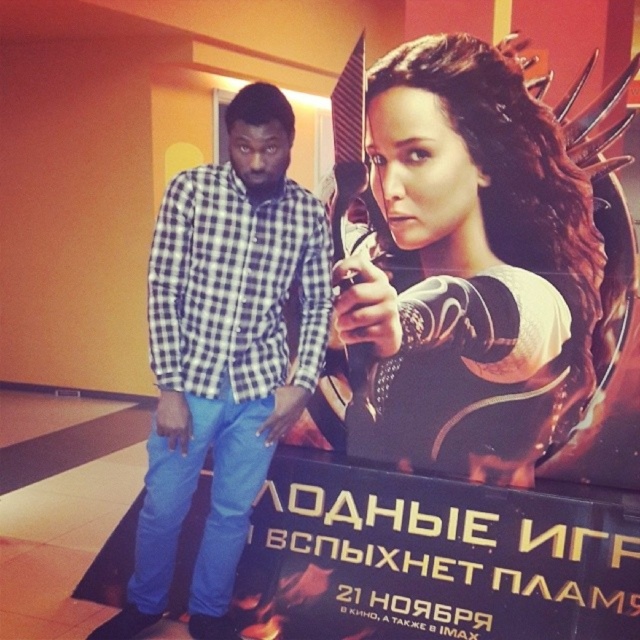
Which is more to the left, shiny black armor at center or checkered fabric shirt at center?

checkered fabric shirt at center

At what (x,y) coordinates should I click in order to perform the action: click on shiny black armor at center. Please return your answer as a coordinate pair (x, y). Looking at the image, I should click on (468, 268).

The width and height of the screenshot is (640, 640). Describe the element at coordinates (468, 268) in the screenshot. I see `shiny black armor at center` at that location.

Find the location of a particular element. The width and height of the screenshot is (640, 640). shiny black armor at center is located at coordinates (468, 268).